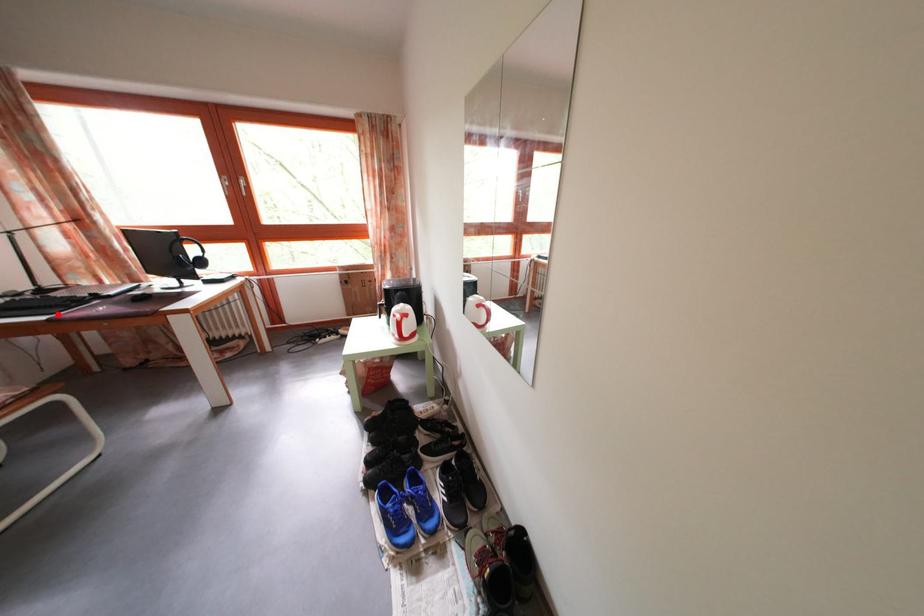
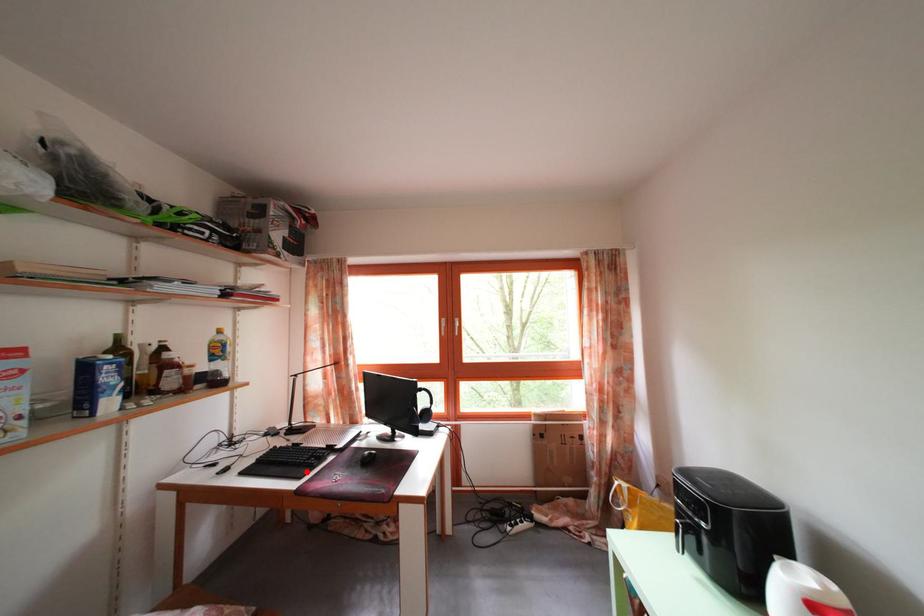
I am providing you with two images of the same scene from different viewpoints. A red point is marked on the first image and another point is marked on the second image. Do the highlighted points in image1 and image2 indicate the same real-world spot?

Yes